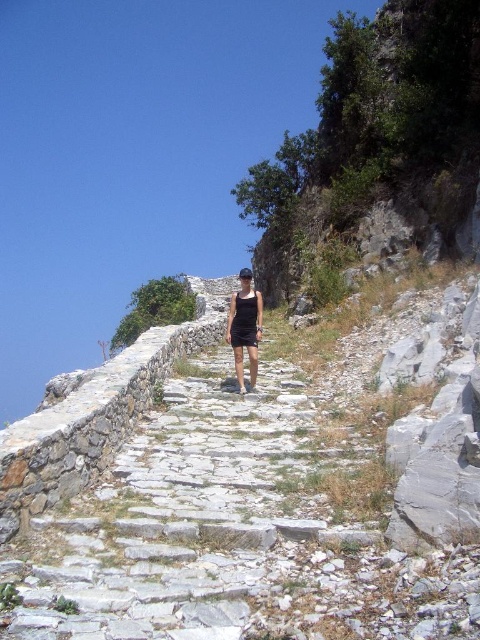
Question: Does green leafy hillside at upper right appear under black matte shorts at center?

Choices:
 (A) yes
 (B) no

Answer: (B)

Question: Which point appears closest to the camera in this image?

Choices:
 (A) (240, 330)
 (B) (372, 113)

Answer: (A)

Question: Does green leafy hillside at upper right have a larger size compared to black matte shorts at center?

Choices:
 (A) no
 (B) yes

Answer: (B)

Question: Is green leafy hillside at upper right wider than black matte shorts at center?

Choices:
 (A) no
 (B) yes

Answer: (B)